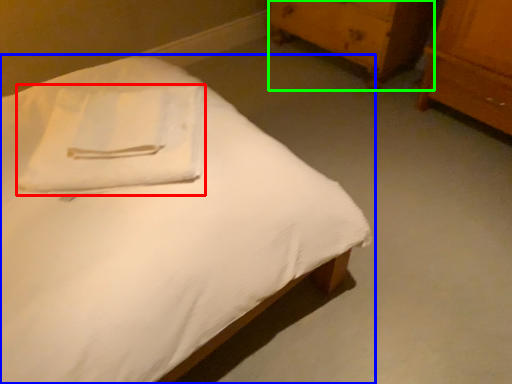
Question: Based on their relative distances, which object is nearer to cloth (highlighted by a red box)? Choose from bed (highlighted by a blue box) and chest of drawers (highlighted by a green box).

Choices:
 (A) bed
 (B) chest of drawers

Answer: (A)